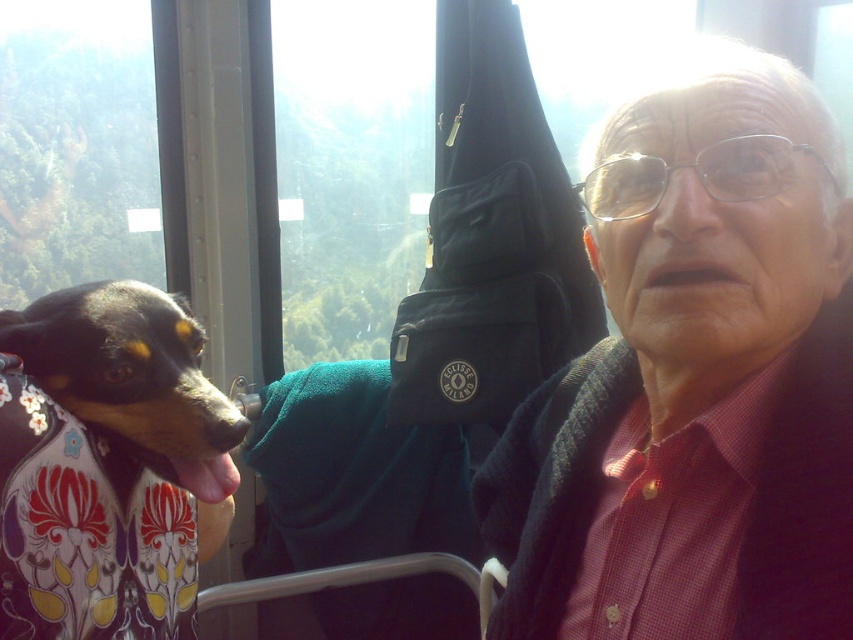
Is matte black jacket at center positioned before smooth black and tan dog at left?

That is True.

Can you confirm if matte black jacket at center is taller than smooth black and tan dog at left?

Indeed, matte black jacket at center has a greater height compared to smooth black and tan dog at left.

This screenshot has height=640, width=853. What are the coordinates of `matte black jacket at center` in the screenshot? It's located at (695, 381).